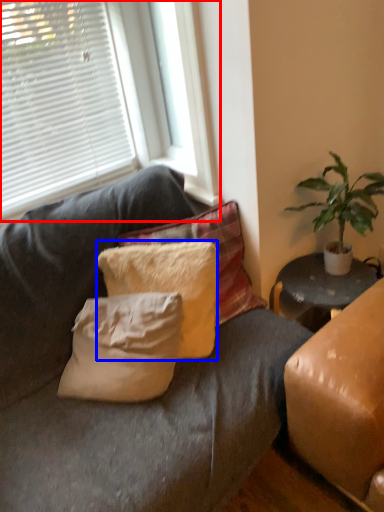
Question: Which of the following is the closest to the observer, window (highlighted by a red box) or pillow (highlighted by a blue box)?

Choices:
 (A) window
 (B) pillow

Answer: (A)